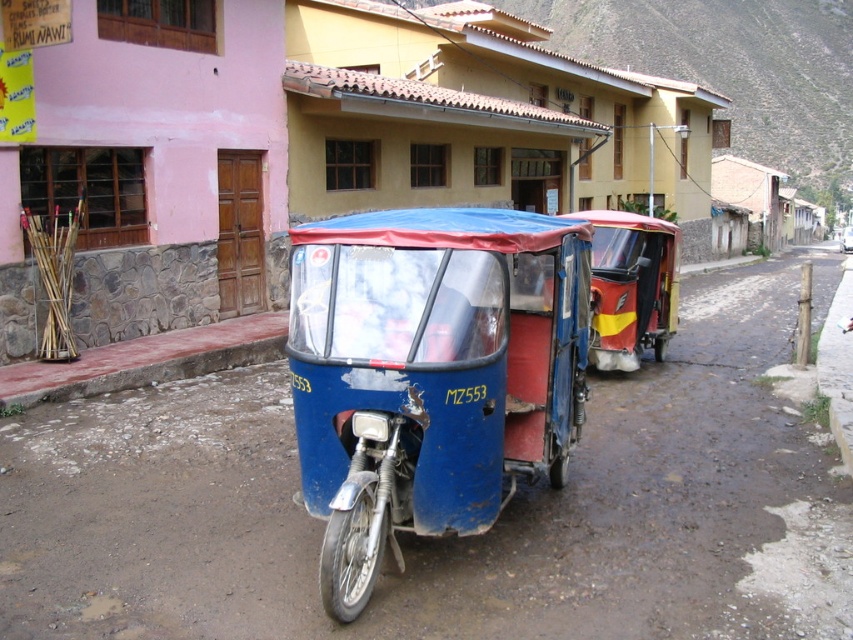
Question: Is blue matte tricycle at center smaller than red glossy tricycle at center?

Choices:
 (A) yes
 (B) no

Answer: (B)

Question: From the image, what is the correct spatial relationship of blue matte tricycle at center in relation to red glossy tricycle at center?

Choices:
 (A) left
 (B) right

Answer: (A)

Question: Does blue matte tricycle at center come in front of red glossy tricycle at center?

Choices:
 (A) yes
 (B) no

Answer: (A)

Question: Which of the following is the farthest from the observer?

Choices:
 (A) (471, 506)
 (B) (665, 228)

Answer: (B)

Question: Among these objects, which one is farthest from the camera?

Choices:
 (A) red glossy tricycle at center
 (B) blue matte tricycle at center

Answer: (A)